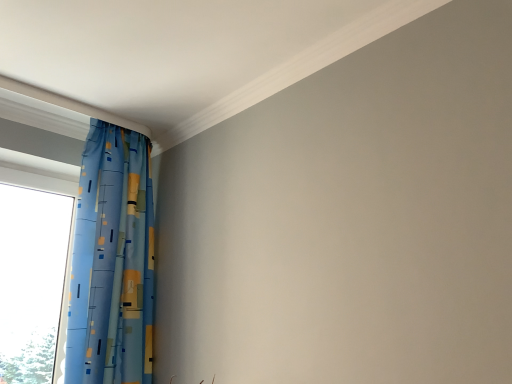
Question: Is the depth of transparent glass window at left less than that of blue printed fabric curtain at left?

Choices:
 (A) yes
 (B) no

Answer: (B)

Question: Can you confirm if transparent glass window at left is shorter than blue printed fabric curtain at left?

Choices:
 (A) no
 (B) yes

Answer: (B)

Question: Is transparent glass window at left taller than blue printed fabric curtain at left?

Choices:
 (A) no
 (B) yes

Answer: (A)

Question: Considering the relative sizes of transparent glass window at left and blue printed fabric curtain at left in the image provided, is transparent glass window at left smaller than blue printed fabric curtain at left?

Choices:
 (A) no
 (B) yes

Answer: (B)

Question: Would you say transparent glass window at left is a long distance from blue printed fabric curtain at left?

Choices:
 (A) yes
 (B) no

Answer: (B)

Question: From a real-world perspective, is transparent glass window at left physically above blue printed fabric curtain at left?

Choices:
 (A) no
 (B) yes

Answer: (A)

Question: From the image's perspective, is blue printed fabric curtain at left under transparent glass window at left?

Choices:
 (A) yes
 (B) no

Answer: (B)

Question: Can you confirm if blue printed fabric curtain at left is shorter than transparent glass window at left?

Choices:
 (A) yes
 (B) no

Answer: (B)

Question: From a real-world perspective, is blue printed fabric curtain at left located higher than transparent glass window at left?

Choices:
 (A) yes
 (B) no

Answer: (A)

Question: Considering the relative positions of blue printed fabric curtain at left and transparent glass window at left in the image provided, is blue printed fabric curtain at left to the left of transparent glass window at left from the viewer's perspective?

Choices:
 (A) yes
 (B) no

Answer: (B)

Question: Are blue printed fabric curtain at left and transparent glass window at left beside each other?

Choices:
 (A) no
 (B) yes

Answer: (A)

Question: Is blue printed fabric curtain at left taller than transparent glass window at left?

Choices:
 (A) no
 (B) yes

Answer: (B)

Question: Considering the positions of transparent glass window at left and blue printed fabric curtain at left in the image, is transparent glass window at left taller or shorter than blue printed fabric curtain at left?

Choices:
 (A) tall
 (B) short

Answer: (B)